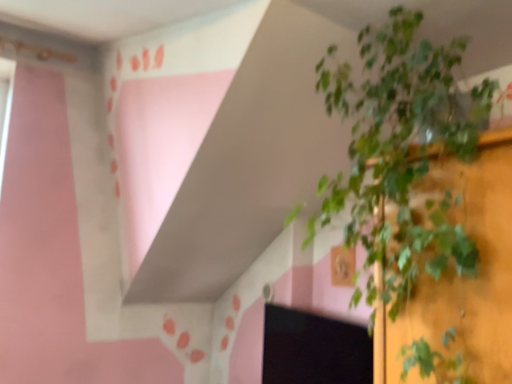
Find the location of `black matte computer screen at lower right`. black matte computer screen at lower right is located at coordinates (314, 349).

The height and width of the screenshot is (384, 512). Describe the element at coordinates (314, 349) in the screenshot. I see `black matte computer screen at lower right` at that location.

The width and height of the screenshot is (512, 384). What do you see at coordinates (400, 147) in the screenshot?
I see `green leafy plant at center` at bounding box center [400, 147].

Locate an element on the screen. This screenshot has width=512, height=384. green leafy plant at center is located at coordinates (400, 147).

Identify the location of black matte computer screen at lower right. The width and height of the screenshot is (512, 384). (314, 349).

Which object is positioned more to the left, green leafy plant at center or black matte computer screen at lower right?

black matte computer screen at lower right.

Is the position of green leafy plant at center more distant than that of black matte computer screen at lower right?

No.

Which is nearer, (432, 127) or (334, 336)?

Point (432, 127) appears to be closer to the viewer than point (334, 336).

From the image's perspective, is green leafy plant at center above black matte computer screen at lower right?

Indeed, from the image's perspective, green leafy plant at center is shown above black matte computer screen at lower right.

From a real-world perspective, between green leafy plant at center and black matte computer screen at lower right, who is vertically higher?

green leafy plant at center, from a real-world perspective.

Which object is thinner, green leafy plant at center or black matte computer screen at lower right?

With smaller width is black matte computer screen at lower right.

Considering the sizes of objects green leafy plant at center and black matte computer screen at lower right in the image provided, who is shorter, green leafy plant at center or black matte computer screen at lower right?

black matte computer screen at lower right.

Can you confirm if green leafy plant at center is bigger than black matte computer screen at lower right?

Yes, green leafy plant at center is bigger than black matte computer screen at lower right.

Is green leafy plant at center spatially inside black matte computer screen at lower right, or outside of it?

green leafy plant at center is not inside black matte computer screen at lower right, it's outside.

Is green leafy plant at center next to black matte computer screen at lower right and touching it?

No, green leafy plant at center is not with black matte computer screen at lower right.

Does green leafy plant at center turn towards black matte computer screen at lower right?

No, green leafy plant at center does not turn towards black matte computer screen at lower right.

Based on the photo, how many degrees apart are the facing directions of green leafy plant at center and black matte computer screen at lower right?

green leafy plant at center and black matte computer screen at lower right are facing 3.29 degrees away from each other.

The image size is (512, 384). Identify the location of computer screen below the green leafy plant at center (from the image's perspective). (314, 349).

Can you confirm if black matte computer screen at lower right is positioned to the right of green leafy plant at center?

Incorrect, black matte computer screen at lower right is not on the right side of green leafy plant at center.

Considering the positions of objects black matte computer screen at lower right and green leafy plant at center in the image provided, who is behind, black matte computer screen at lower right or green leafy plant at center?

Positioned behind is black matte computer screen at lower right.

Does point (293, 383) come farther from viewer compared to point (461, 51)?

Yes, point (293, 383) is behind point (461, 51).

From the image's perspective, is black matte computer screen at lower right above green leafy plant at center?

No.

From a real-world perspective, is black matte computer screen at lower right on green leafy plant at center?

No, from a real-world perspective, black matte computer screen at lower right is not above green leafy plant at center.

Considering the relative sizes of black matte computer screen at lower right and green leafy plant at center in the image provided, is black matte computer screen at lower right thinner than green leafy plant at center?

Indeed, black matte computer screen at lower right has a lesser width compared to green leafy plant at center.

Considering the sizes of objects black matte computer screen at lower right and green leafy plant at center in the image provided, who is shorter, black matte computer screen at lower right or green leafy plant at center?

Standing shorter between the two is black matte computer screen at lower right.

Considering the sizes of objects black matte computer screen at lower right and green leafy plant at center in the image provided, who is smaller, black matte computer screen at lower right or green leafy plant at center?

With smaller size is black matte computer screen at lower right.

In the scene shown: Is green leafy plant at center a part of black matte computer screen at lower right?

That's incorrect, green leafy plant at center is not inside black matte computer screen at lower right.

Is black matte computer screen at lower right not close to green leafy plant at center?

black matte computer screen at lower right is actually quite close to green leafy plant at center.

Is black matte computer screen at lower right oriented away from green leafy plant at center?

black matte computer screen at lower right does not have its back to green leafy plant at center.

How much distance is there between black matte computer screen at lower right and green leafy plant at center?

black matte computer screen at lower right is 28.79 inches from green leafy plant at center.

Where is `houseplant in front of the black matte computer screen at lower right`? houseplant in front of the black matte computer screen at lower right is located at coordinates (400, 147).

I want to click on houseplant above the black matte computer screen at lower right (from a real-world perspective), so click(400, 147).

At what (x,y) coordinates should I click in order to perform the action: click on computer screen behind the green leafy plant at center. Please return your answer as a coordinate pair (x, y). This screenshot has height=384, width=512. Looking at the image, I should click on (314, 349).